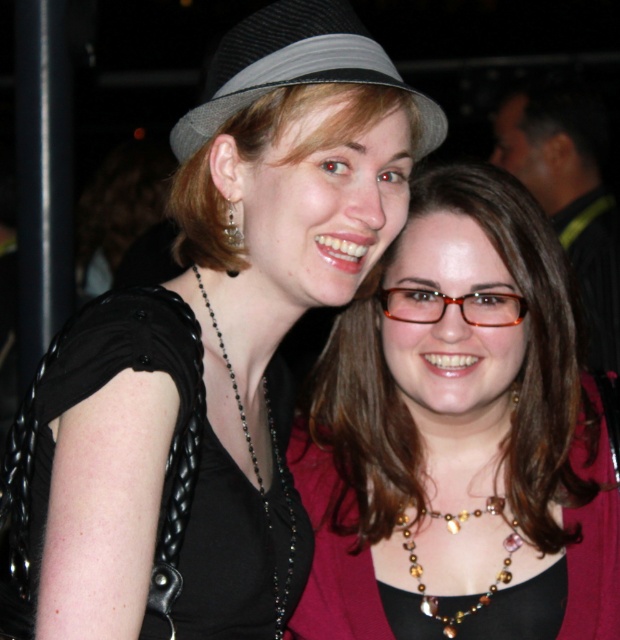
Question: Can you confirm if black braided fabric dress at left is positioned below gray felt fedora at upper center?

Choices:
 (A) yes
 (B) no

Answer: (A)

Question: Which of the following is the closest to the observer?

Choices:
 (A) (337, 74)
 (B) (513, 538)
 (C) (226, 52)

Answer: (A)

Question: Can you confirm if matte black necklace at center is positioned to the left of multicolored beaded necklace at center?

Choices:
 (A) no
 (B) yes

Answer: (A)

Question: Can you confirm if gray felt fedora at upper center is smaller than multicolored beaded necklace at center?

Choices:
 (A) no
 (B) yes

Answer: (A)

Question: Which of these objects is positioned farthest from the matte black necklace at center?

Choices:
 (A) black braided fabric dress at left
 (B) gray felt fedora at upper center
 (C) matte black hat at upper center
 (D) matte black glasses at center

Answer: (D)

Question: Among these points, which one is farthest from the camera?

Choices:
 (A) (414, 522)
 (B) (465, 269)
 (C) (372, 218)

Answer: (A)